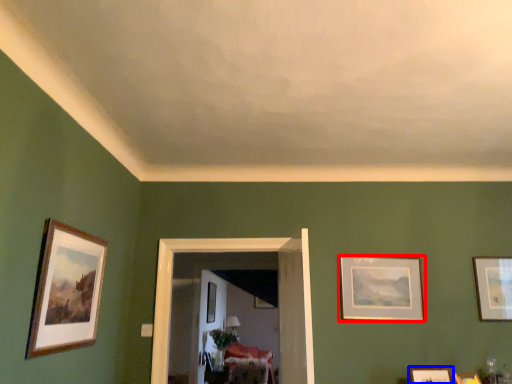
Question: Which object appears closest to the camera in this image, picture frame (highlighted by a red box) or picture frame (highlighted by a blue box)?

Choices:
 (A) picture frame
 (B) picture frame

Answer: (B)